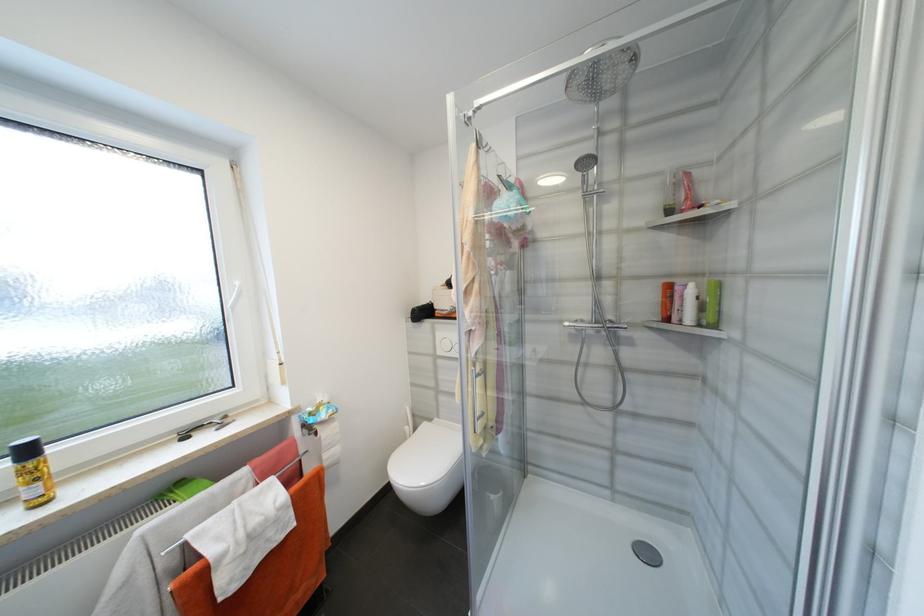
Find where to lift the orange shampoo bottle. Please return your answer as a coordinate pair (x, y).

(31, 472)